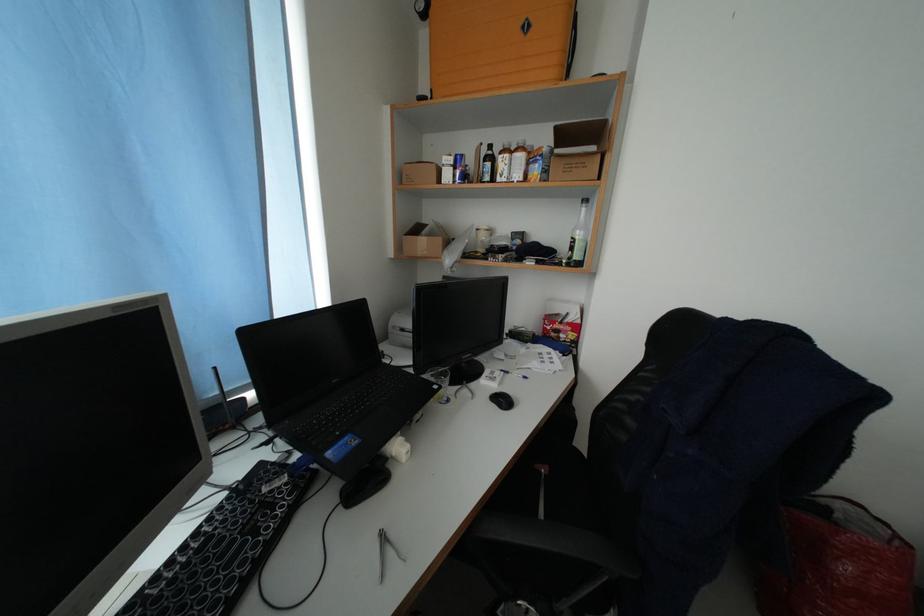
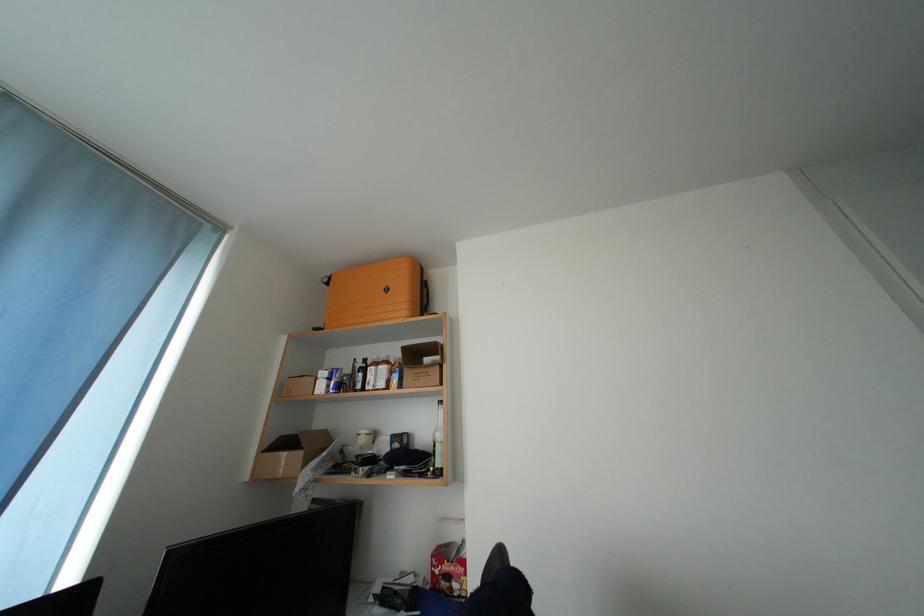
Question: The images are taken continuously from a first-person perspective. In which direction is your viewpoint rotating?

Choices:
 (A) Left
 (B) Right
 (C) Up
 (D) Down

Answer: (C)